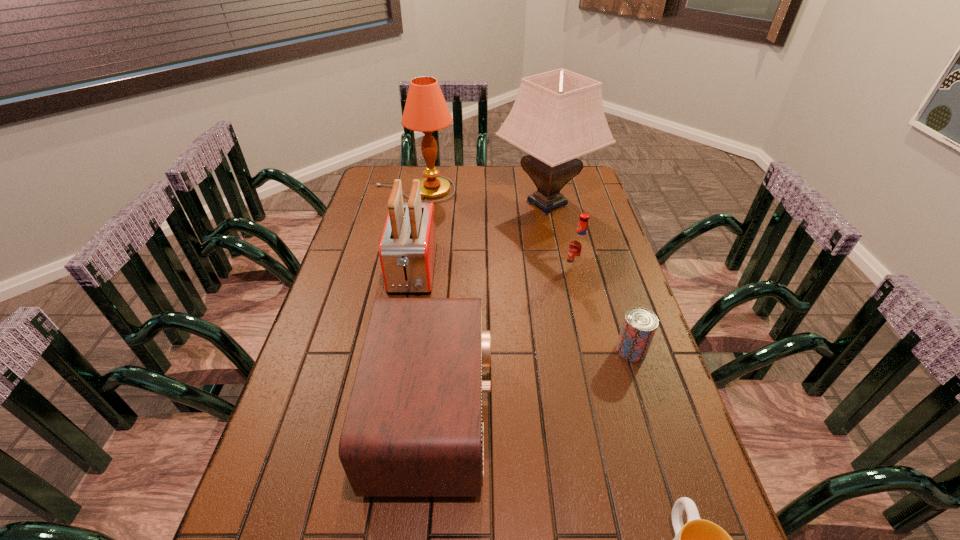
The height and width of the screenshot is (540, 960). In order to click on the second closest object to the root beer in this screenshot , I will do `click(639, 326)`.

Locate which object ranks sixth in proximity to the lampshade. Please provide its 2D coordinates. Your answer should be formatted as a tuple, i.e. [(x, y)], where the tuple contains the x and y coordinates of a point satisfying the conditions above.

[(699, 539)]